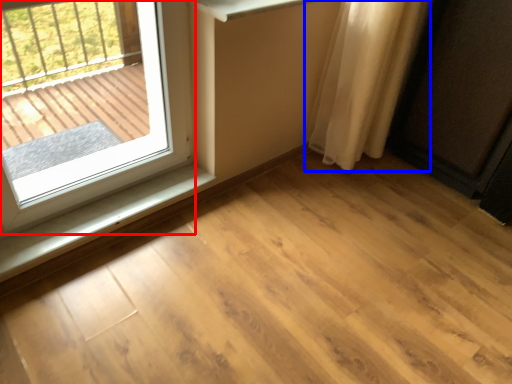
Question: Which object is further to the camera taking this photo, window (highlighted by a red box) or curtain (highlighted by a blue box)?

Choices:
 (A) window
 (B) curtain

Answer: (B)